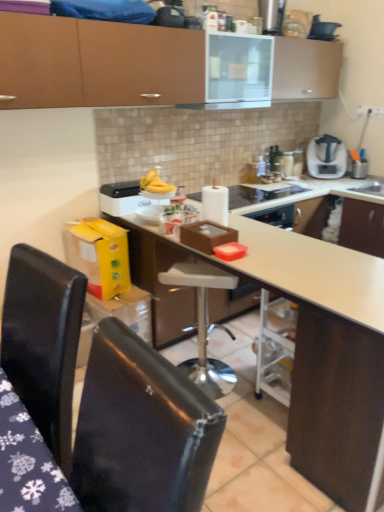
At what (x,y) coordinates should I click in order to perform the action: click on matte brown cabinet at upper center. Please return your answer as a coordinate pair (x, y). The image size is (384, 512). Looking at the image, I should click on (97, 63).

This screenshot has height=512, width=384. Describe the element at coordinates (203, 325) in the screenshot. I see `white plastic bar stool at center` at that location.

Find the location of a particular element. This screenshot has width=384, height=512. black plastic kettle at upper center is located at coordinates (323, 29).

You are a GUI agent. You are given a task and a screenshot of the screen. Output one action in this format:
    pyautogui.click(x=<x>, y=<y>)
    Task: Click on the matte brown cabinet at upper center
    
    Given the screenshot: What is the action you would take?
    (97, 63)

Between point (209, 280) and point (4, 53), which one is positioned in front?

The point (4, 53) is closer.

Looking at this image, from a real-world perspective, who is located higher, white plastic bar stool at center or matte brown cabinet at upper center?

matte brown cabinet at upper center is physically above.

Is white plastic bar stool at center at the left side of matte brown cabinet at upper center?

Yes.

How different are the orientations of white plastic bar stool at center and matte brown cabinet at upper center in degrees?

39 degrees separate the facing orientations of white plastic bar stool at center and matte brown cabinet at upper center.

Is white plastic toaster at upper center wider or thinner than glossy black chair at lower left, the 1th chair in the right-to-left sequence?

white plastic toaster at upper center is thinner than glossy black chair at lower left, the 1th chair in the right-to-left sequence.

How many degrees apart are the facing directions of white plastic toaster at upper center and glossy black chair at lower left, the 1th chair in the right-to-left sequence?

The angle between the facing direction of white plastic toaster at upper center and the facing direction of glossy black chair at lower left, the 1th chair in the right-to-left sequence, is 90.2 degrees.

At what (x,y) coordinates should I click in order to perform the action: click on kitchen appliance behind the glossy black chair at lower left, the 1th chair in the right-to-left sequence. Please return your answer as a coordinate pair (x, y). Looking at the image, I should click on (124, 198).

Is white plastic toaster at upper center smaller than glossy black chair at lower left, the 1th chair in the right-to-left sequence?

Indeed, white plastic toaster at upper center has a smaller size compared to glossy black chair at lower left, the 1th chair in the right-to-left sequence.

Is glossy black chair at lower left, which is the 2th chair in left-to-right order, outside of white plastic toaster at upper center?

Yes, glossy black chair at lower left, which is the 2th chair in left-to-right order, is outside of white plastic toaster at upper center.

Is glossy black chair at lower left, the 1th chair in the right-to-left sequence, positioned in front of white plastic toaster at upper center?

Yes, it is in front of white plastic toaster at upper center.

Which object is positioned more to the left, glossy black chair at lower left, which is the 2th chair in left-to-right order, or white plastic toaster at upper center?

Positioned to the left is white plastic toaster at upper center.

At what (x,y) coordinates should I click in order to perform the action: click on home appliance behind the white plastic bar stool at center. Please return your answer as a coordinate pair (x, y). Looking at the image, I should click on [326, 157].

Between white plastic bar stool at center and satin silver blender at upper right, which one is positioned in front?

white plastic bar stool at center is closer to the camera.

Is white plastic bar stool at center spatially inside satin silver blender at upper right, or outside of it?

white plastic bar stool at center cannot be found inside satin silver blender at upper right.

Is white plastic bar stool at center turned away from satin silver blender at upper right?

No, white plastic bar stool at center is not facing the opposite direction of satin silver blender at upper right.

Can you confirm if black leather chair at lower left, placed as the 1th chair when sorted from left to right, is smaller than white plastic toaster at upper center?

Actually, black leather chair at lower left, placed as the 1th chair when sorted from left to right, might be larger than white plastic toaster at upper center.

Is black leather chair at lower left, which appears as the 2th chair when viewed from the right, positioned behind white plastic toaster at upper center?

No, it is in front of white plastic toaster at upper center.

Between point (62, 283) and point (132, 198), which one is positioned behind?

The point (132, 198) is farther from the camera.

Which point is more distant from viewer, [320,444] or [316,17]?

Positioned behind is point [316,17].

Based on the photo, how different are the orientations of white matte countertop at center and black plastic kettle at upper center in degrees?

white matte countertop at center and black plastic kettle at upper center are facing 90.2 degrees away from each other.

Is white matte countertop at center beside black plastic kettle at upper center?

No.

Based on their sizes in the image, would you say white matte countertop at center is bigger or smaller than black plastic kettle at upper center?

Clearly, white matte countertop at center is larger in size than black plastic kettle at upper center.

Would you say satin silver blender at upper right is inside or outside glossy black chair at lower left, which is the 2th chair in left-to-right order?

satin silver blender at upper right exists outside the volume of glossy black chair at lower left, which is the 2th chair in left-to-right order.

Is satin silver blender at upper right facing towards glossy black chair at lower left, which is the 2th chair in left-to-right order?

Yes, satin silver blender at upper right is oriented towards glossy black chair at lower left, which is the 2th chair in left-to-right order.

Which of these two, satin silver blender at upper right or glossy black chair at lower left, which is the 2th chair in left-to-right order, is thinner?

satin silver blender at upper right.

Considering the positions of points (323, 154) and (126, 343), is point (323, 154) closer to camera compared to point (126, 343)?

No, it is not.

Identify the location of cabinetry lying on the right of white plastic bar stool at center. (97, 63).

Find the location of `kitchen appliance above the glossy black chair at lower left, the 1th chair in the right-to-left sequence (from the image's perspective)`. kitchen appliance above the glossy black chair at lower left, the 1th chair in the right-to-left sequence (from the image's perspective) is located at coordinates (124, 198).

Considering their positions, is white plastic toaster at upper center positioned further to white matte countertop at center than black plastic kettle at upper center?

black plastic kettle at upper center.

Based on their spatial positions, is white plastic toaster at upper center or white matte countertop at center closer to satin silver blender at upper right?

white plastic toaster at upper center lies closer to satin silver blender at upper right than the other object.

From the image, which object appears to be nearer to white plastic toaster at upper center, satin silver blender at upper right or white plastic bar stool at center?

The object closer to white plastic toaster at upper center is white plastic bar stool at center.

From the image, which object appears to be farther from white plastic toaster at upper center, white matte countertop at center or white glossy exhaust hood at upper center?

The object further to white plastic toaster at upper center is white glossy exhaust hood at upper center.

From the image, which object appears to be nearer to matte brown cabinet at upper center, glossy black chair at lower left, the 1th chair in the right-to-left sequence, or white matte countertop at center?

Among the two, white matte countertop at center is located nearer to matte brown cabinet at upper center.

Based on their spatial positions, is white plastic toaster at upper center or white glossy exhaust hood at upper center further from white matte countertop at center?

The object further to white matte countertop at center is white glossy exhaust hood at upper center.

Estimate the real-world distances between objects in this image. Which object is further from black plastic kettle at upper center, black leather chair at lower left, placed as the 1th chair when sorted from left to right, or white glossy exhaust hood at upper center?

black leather chair at lower left, placed as the 1th chair when sorted from left to right, is further to black plastic kettle at upper center.

Considering their positions, is glossy black chair at lower left, which is the 2th chair in left-to-right order, positioned further to black plastic kettle at upper center than black leather chair at lower left, placed as the 1th chair when sorted from left to right?

glossy black chair at lower left, which is the 2th chair in left-to-right order, lies further to black plastic kettle at upper center than the other object.

Where is `cabinetry located between glossy black chair at lower left, the 1th chair in the right-to-left sequence, and white plastic toaster at upper center in the depth direction`? The height and width of the screenshot is (512, 384). cabinetry located between glossy black chair at lower left, the 1th chair in the right-to-left sequence, and white plastic toaster at upper center in the depth direction is located at coordinates (97, 63).

The height and width of the screenshot is (512, 384). I want to click on kitchen appliance between black plastic kettle at upper center and black leather chair at lower left, placed as the 1th chair when sorted from left to right, in the up-down direction, so click(124, 198).

Find the location of a particular element. Image resolution: width=384 pixels, height=512 pixels. kitchen appliance located between black leather chair at lower left, placed as the 1th chair when sorted from left to right, and satin silver blender at upper right in the depth direction is located at coordinates (124, 198).

Where is `appliance located between glossy black chair at lower left, which is the 2th chair in left-to-right order, and satin silver blender at upper right in the depth direction`? appliance located between glossy black chair at lower left, which is the 2th chair in left-to-right order, and satin silver blender at upper right in the depth direction is located at coordinates (323, 29).